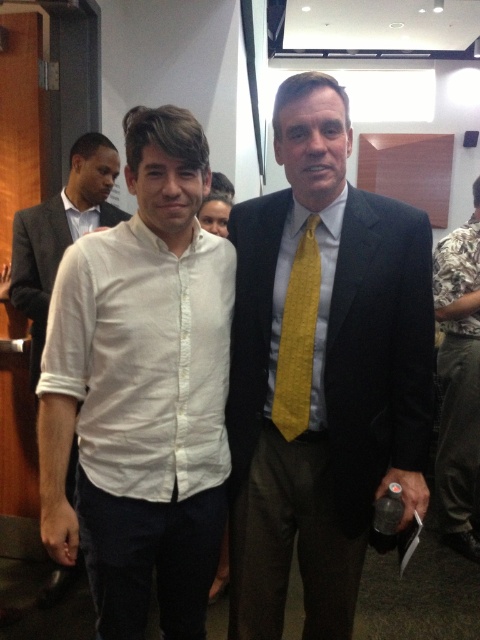
Question: Which of the following is the farthest from the observer?

Choices:
 (A) yellow woven tie at center
 (B) white cotton shirt at center
 (C) matte black suit at center

Answer: (B)

Question: Does matte black suit at center have a greater width compared to white cotton shirt at center?

Choices:
 (A) no
 (B) yes

Answer: (B)

Question: Is white linen shirt at center positioned behind white cotton shirt at center?

Choices:
 (A) yes
 (B) no

Answer: (B)

Question: Which object is closer to the camera taking this photo?

Choices:
 (A) yellow woven tie at center
 (B) white linen shirt at center

Answer: (B)

Question: Can you confirm if white linen shirt at center is positioned to the left of yellow woven tie at center?

Choices:
 (A) yes
 (B) no

Answer: (A)

Question: Which point is closer to the camera?

Choices:
 (A) (32, 364)
 (B) (298, 404)
 (C) (173, 364)
 (D) (457, 492)

Answer: (C)